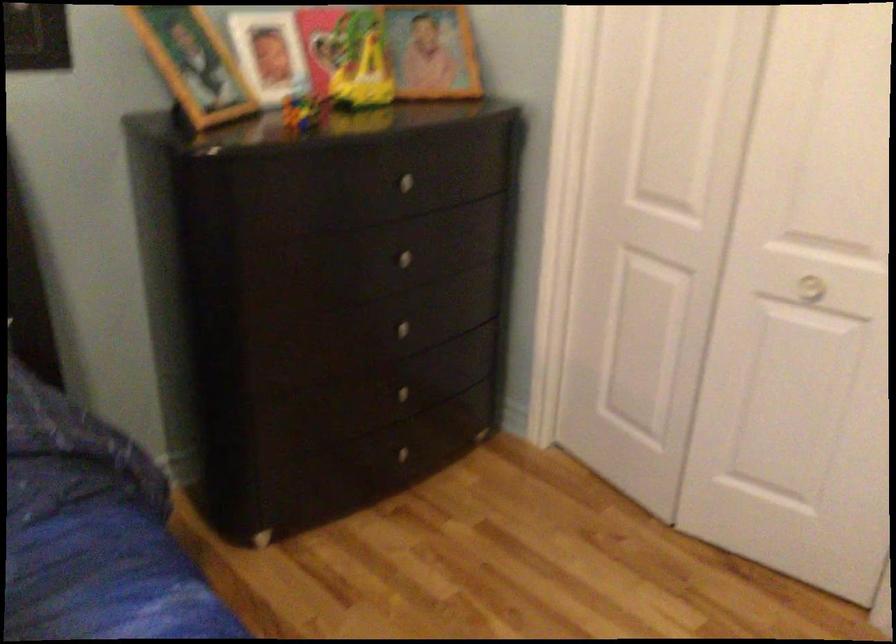
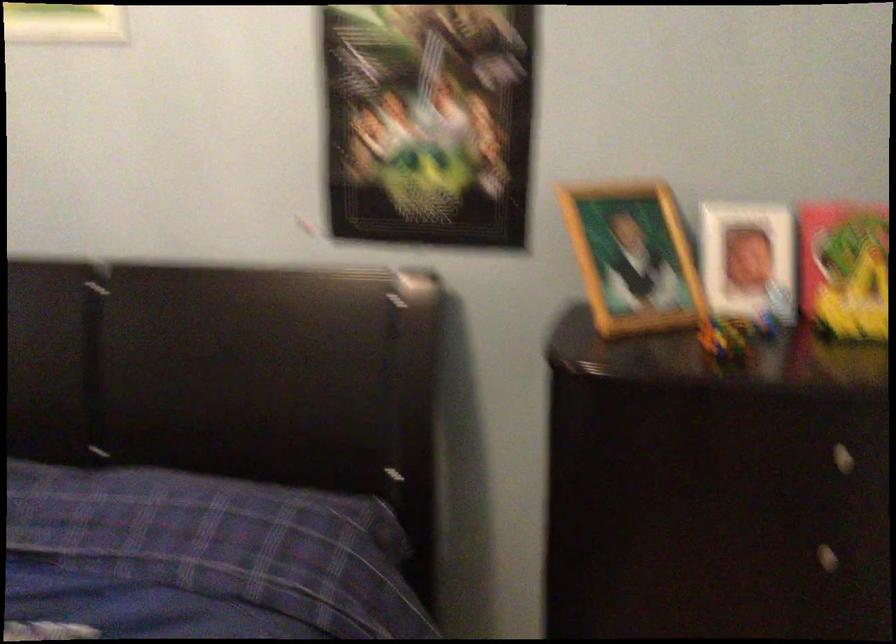
In the second image, find the point that corresponds to the point at 397,265 in the first image.

(807, 554)